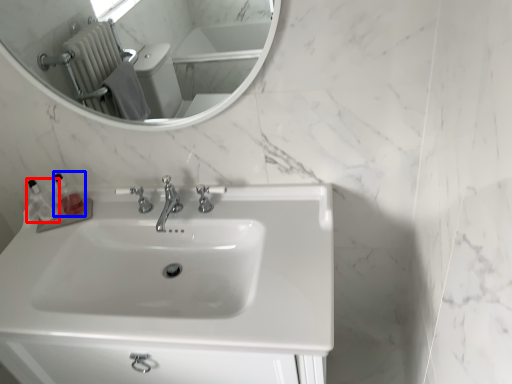
Question: Which point is closer to the camera, toiletry (highlighted by a red box) or toiletry (highlighted by a blue box)?

Choices:
 (A) toiletry
 (B) toiletry

Answer: (A)